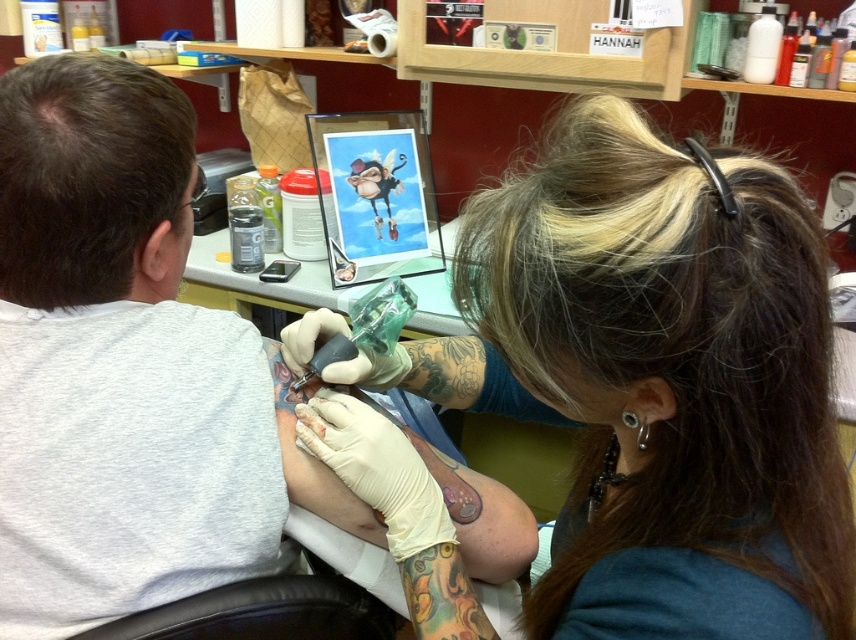
Based on the photo, you are a client in the tattoo parlor and you see the smooth skin at upper right and the white latex gloves at upper center. Which object is positioned to the right side of the other?

The smooth skin at upper right is positioned to the right of the white latex gloves at upper center.

You are a new tattoo artist in the parlor and need to place a small sticker on the object with the greater height. Which object should you choose between the smooth skin at upper right and the white latex gloves at upper center?

The white latex gloves at upper center has a greater height than the smooth skin at upper right, so you should place the sticker on the white latex gloves at upper center.

You are a new tattoo artist entering the studio and see the smooth skin at upper right and the white latex gloves at upper center. Which object is bigger in size?

The smooth skin at upper right has a larger size compared to the white latex gloves at upper center.